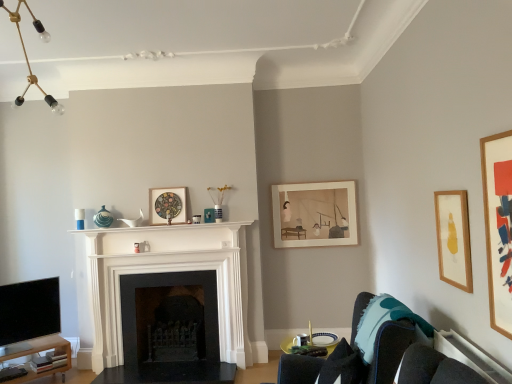
Question: From the image's perspective, does white marble fireplace at center, marked as the first fireplace in a front-to-back arrangement, appear higher than white glossy mantle at center?

Choices:
 (A) yes
 (B) no

Answer: (B)

Question: Does white marble fireplace at center, marked as the first fireplace in a front-to-back arrangement, have a lesser width compared to white glossy mantle at center?

Choices:
 (A) no
 (B) yes

Answer: (B)

Question: Can you confirm if white marble fireplace at center, marked as the first fireplace in a front-to-back arrangement, is shorter than white glossy mantle at center?

Choices:
 (A) yes
 (B) no

Answer: (B)

Question: From the image's perspective, is white marble fireplace at center, which ranks as the second fireplace in back-to-front order, below white glossy mantle at center?

Choices:
 (A) no
 (B) yes

Answer: (B)

Question: Is white marble fireplace at center, marked as the first fireplace in a front-to-back arrangement, in contact with white glossy mantle at center?

Choices:
 (A) yes
 (B) no

Answer: (B)

Question: Does white marble fireplace at center, which ranks as the second fireplace in back-to-front order, come behind white glossy mantle at center?

Choices:
 (A) no
 (B) yes

Answer: (B)

Question: Considering the relative sizes of black matte fireplace at center, which is the 2th fireplace in front-to-back order, and black glossy tv at lower left in the image provided, is black matte fireplace at center, which is the 2th fireplace in front-to-back order, shorter than black glossy tv at lower left?

Choices:
 (A) no
 (B) yes

Answer: (A)

Question: Is black matte fireplace at center, positioned as the first fireplace in back-to-front order, oriented towards black glossy tv at lower left?

Choices:
 (A) yes
 (B) no

Answer: (B)

Question: Considering the relative sizes of black matte fireplace at center, positioned as the first fireplace in back-to-front order, and black glossy tv at lower left in the image provided, is black matte fireplace at center, positioned as the first fireplace in back-to-front order, smaller than black glossy tv at lower left?

Choices:
 (A) yes
 (B) no

Answer: (B)

Question: Is black matte fireplace at center, positioned as the first fireplace in back-to-front order, bigger than black glossy tv at lower left?

Choices:
 (A) no
 (B) yes

Answer: (B)

Question: Is black glossy tv at lower left at the back of black matte fireplace at center, positioned as the first fireplace in back-to-front order?

Choices:
 (A) yes
 (B) no

Answer: (B)

Question: Is black matte fireplace at center, positioned as the first fireplace in back-to-front order, thinner than black glossy tv at lower left?

Choices:
 (A) no
 (B) yes

Answer: (A)

Question: Is wooden picture frame at right, marked as the 3th picture frame in a left-to-right arrangement, at the left side of black matte fireplace at center, positioned as the first fireplace in back-to-front order?

Choices:
 (A) yes
 (B) no

Answer: (B)